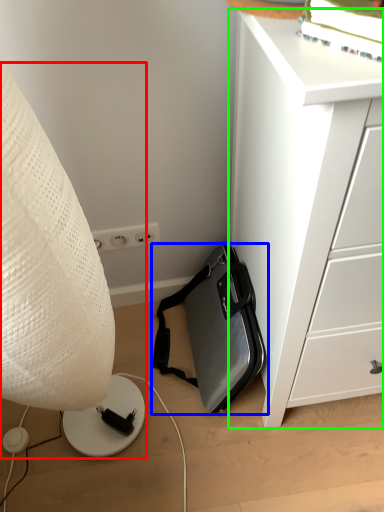
Question: Considering the real-world distances, which object is farthest from lamp (highlighted by a red box)? luggage and bags (highlighted by a blue box) or chest of drawers (highlighted by a green box)?

Choices:
 (A) luggage and bags
 (B) chest of drawers

Answer: (A)